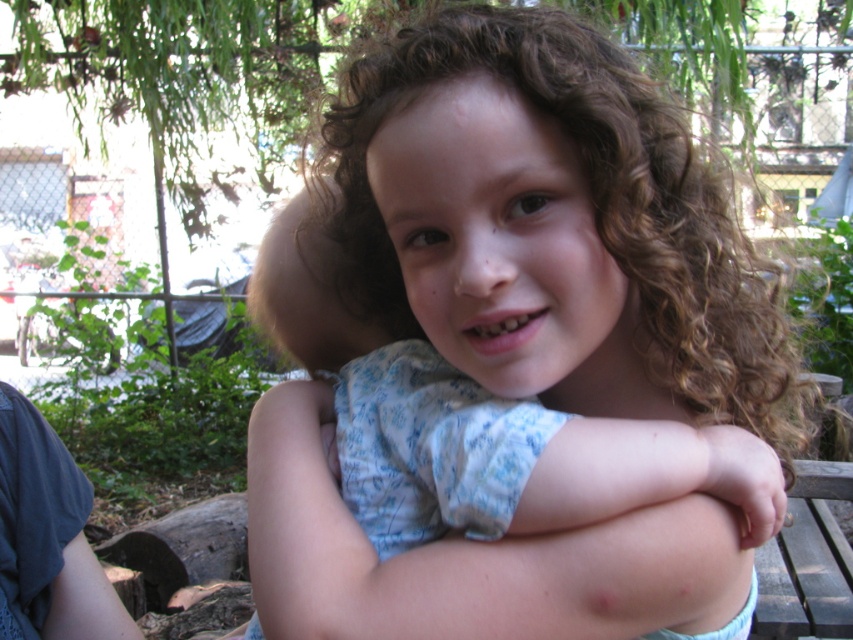
How much distance is there between curly brown hair at center and pale skin at center?

curly brown hair at center is 4.25 inches from pale skin at center.

Is curly brown hair at center closer to camera compared to pale skin at center?

Yes.

The image size is (853, 640). What do you see at coordinates (592, 216) in the screenshot?
I see `curly brown hair at center` at bounding box center [592, 216].

The width and height of the screenshot is (853, 640). In order to click on curly brown hair at center in this screenshot , I will do `click(592, 216)`.

Does curly brown hair at center have a greater width compared to light blue fabric shirt at center?

Yes.

Is point (469, 3) positioned behind point (338, 321)?

No, (469, 3) is in front of (338, 321).

Identify the location of curly brown hair at center. coord(592,216).

Is pale skin at center taller than light blue fabric shirt at center?

No, pale skin at center is not taller than light blue fabric shirt at center.

Does pale skin at center have a lesser height compared to light blue fabric shirt at center?

Indeed, pale skin at center has a lesser height compared to light blue fabric shirt at center.

Where is `pale skin at center`? The height and width of the screenshot is (640, 853). pale skin at center is located at coordinates (468, 557).

Find the location of `pale skin at center`. pale skin at center is located at coordinates (468, 557).